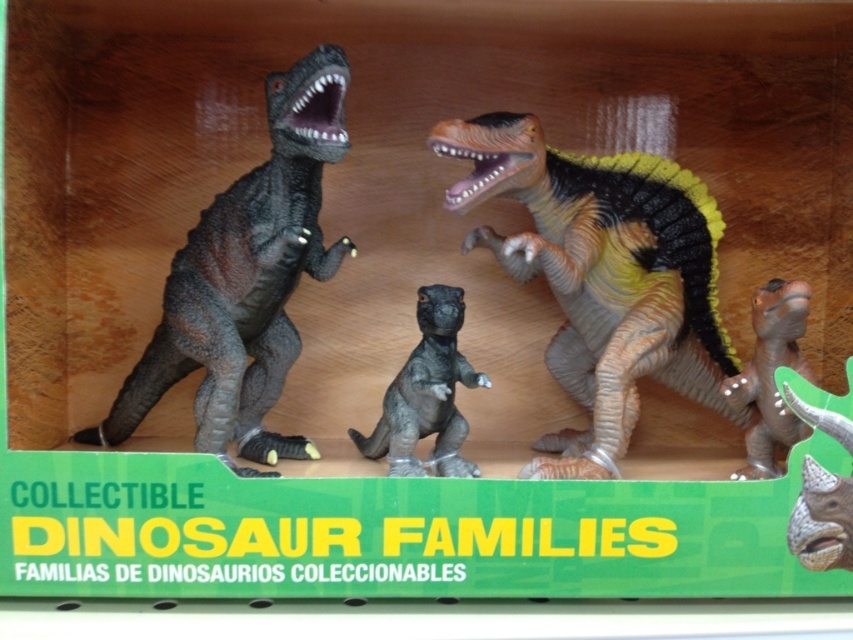
In order to click on orange-yellow textured dinosaur at center in this screenshot , I will do `click(602, 276)`.

Could you measure the distance between orange-yellow textured dinosaur at center and matte gray plastic dinosaur at center?

orange-yellow textured dinosaur at center and matte gray plastic dinosaur at center are 7.72 inches apart.

Image resolution: width=853 pixels, height=640 pixels. What are the coordinates of `orange-yellow textured dinosaur at center` in the screenshot? It's located at (602, 276).

Is point (264, 172) in front of point (453, 396)?

Yes.

Who is higher up, matte black dinosaur at left or matte gray plastic dinosaur at center?

matte black dinosaur at left is above.

Is point (222, 280) positioned in front of point (473, 468)?

Yes, point (222, 280) is in front of point (473, 468).

Identify the location of matte black dinosaur at left. This screenshot has width=853, height=640. (247, 280).

Who is positioned more to the right, orange-yellow textured dinosaur at center or matte gray plastic dinosaur head at lower right?

matte gray plastic dinosaur head at lower right is more to the right.

How much distance is there between orange-yellow textured dinosaur at center and matte gray plastic dinosaur head at lower right?

orange-yellow textured dinosaur at center is 17.44 inches away from matte gray plastic dinosaur head at lower right.

The image size is (853, 640). Describe the element at coordinates (602, 276) in the screenshot. I see `orange-yellow textured dinosaur at center` at that location.

Image resolution: width=853 pixels, height=640 pixels. I want to click on orange-yellow textured dinosaur at center, so click(x=602, y=276).